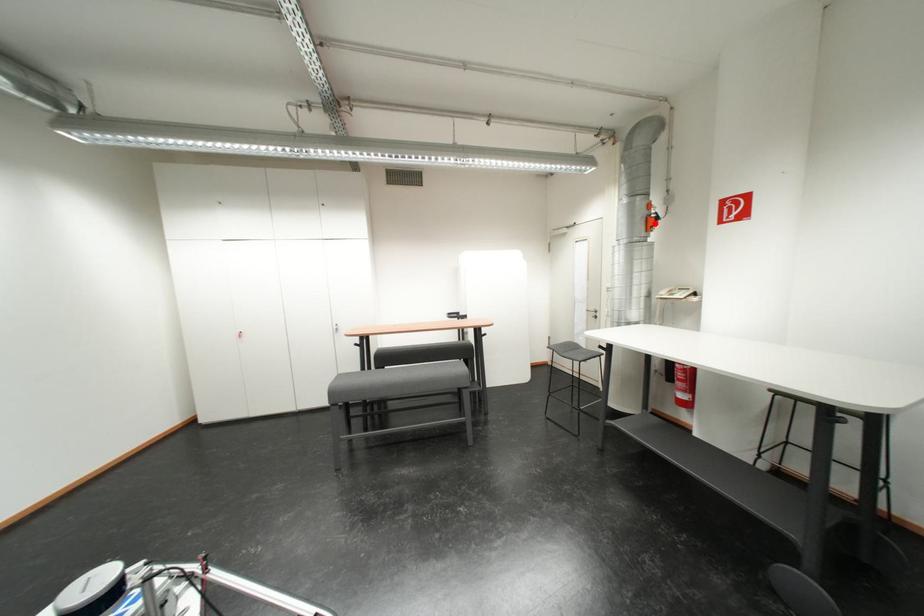
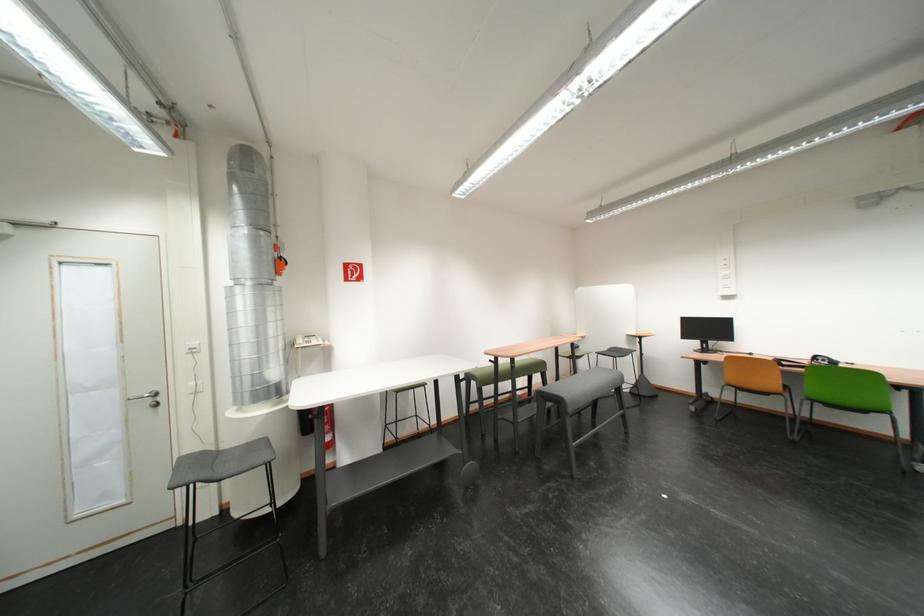
In the second image, find the point that corresponds to the highlighted location in the first image.

(284, 265)